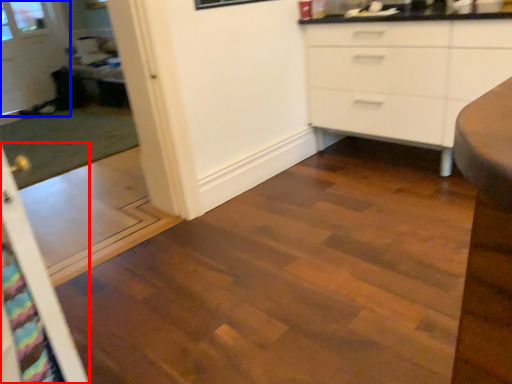
Question: Among these objects, which one is farthest to the camera, screen door (highlighted by a red box) or glass door (highlighted by a blue box)?

Choices:
 (A) screen door
 (B) glass door

Answer: (B)